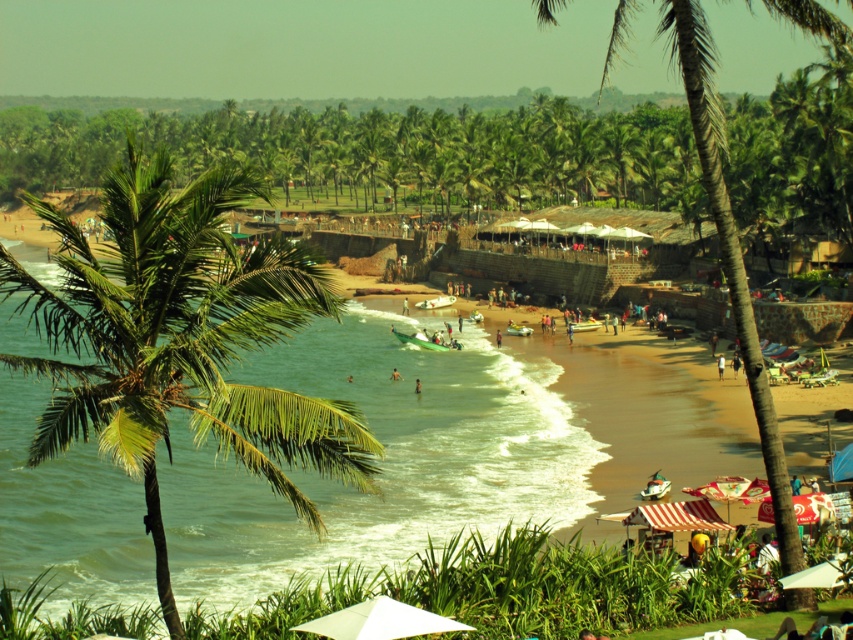
You are a photographer standing at the edge of the beach. You want to take a photo that includes both the green leafy palm tree at center and the dark skin human at center. Based on their positions, will the palm tree appear in front of or behind the human in the photo?

The green leafy palm tree at center is located above the dark skin human at center, so in the photo, the palm tree will appear above the human, not in front or behind. Since they are at the same horizontal center position, their vertical positioning means the tree is overhead, so neither in front nor behind but above.

You are standing on the beach and see the green leafy palm tree at center and the dark skin human at center. Which object is positioned more to your right?

The green leafy palm tree at center is positioned more to the right of the dark skin human at center.